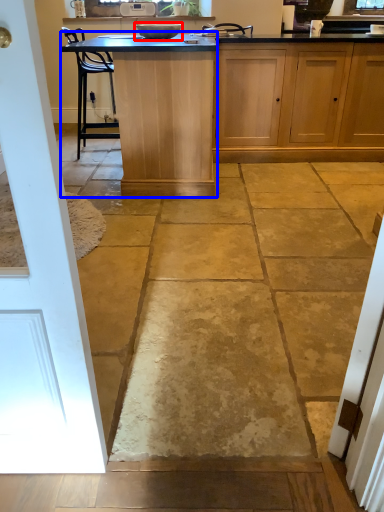
Question: Which object is closer to the camera taking this photo, appliance (highlighted by a red box) or table (highlighted by a blue box)?

Choices:
 (A) appliance
 (B) table

Answer: (B)